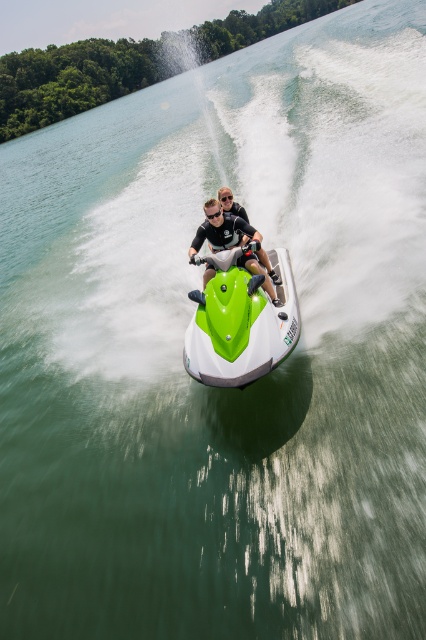
You are a photographer trying to capture the green matte jet ski at center and the matte black helmet at center in a single shot. Since you want to ensure both are clearly visible, which object should you focus on first to account for their size difference?

The green matte jet ski at center is bigger than the matte black helmet at center, so you should focus on the green matte jet ski at center first to ensure its details are sharp before adjusting for the smaller helmet.

You are standing on a dock and see a jet ski with two riders. There is a point at coordinates point (249, 321) that is 4.97 meters away from you. If you want to throw a lifebuoy to the riders, will it reach them if you can throw 5 meters?

The point at point (249, 321) is 4.97 meters away from you, so yes, the lifebuoy will reach them since your throwing distance is 5 meters, which is slightly longer than the distance required.

You are a photographer trying to capture the green matte jet ski at center and the matte black helmet at center in the same frame. Based on their positions, which object should you adjust your camera to focus on first to ensure both are in the frame?

The green matte jet ski at center is to the right of the matte black helmet at center. To include both in the frame, focus on the matte black helmet at center first since it is on the left, then adjust to include the jet ski on the right.